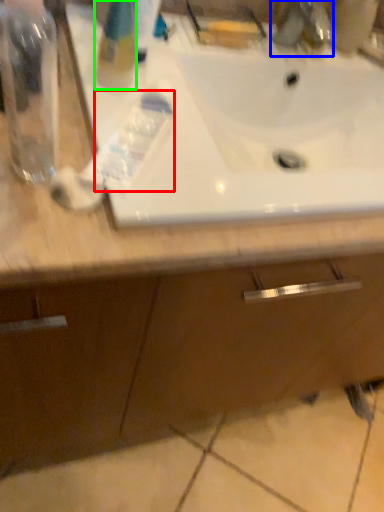
Question: Considering the real-world distances, which object is closest to toothpaste (highlighted by a red box)? plumbing fixture (highlighted by a blue box) or cleaning product (highlighted by a green box).

Choices:
 (A) plumbing fixture
 (B) cleaning product

Answer: (B)